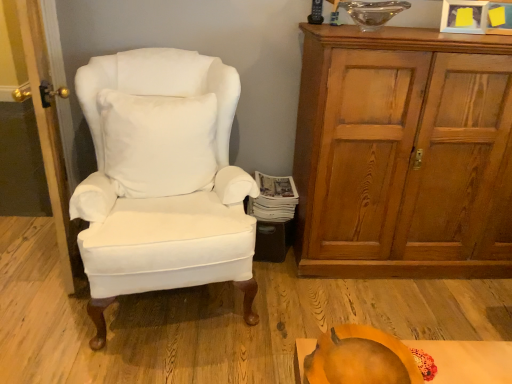
Question: Considering the relative sizes of white cotton wingback chair at left and wooden door at left in the image provided, is white cotton wingback chair at left thinner than wooden door at left?

Choices:
 (A) no
 (B) yes

Answer: (A)

Question: Is white cotton wingback chair at left further to camera compared to wooden door at left?

Choices:
 (A) no
 (B) yes

Answer: (A)

Question: Is white cotton wingback chair at left facing towards wooden door at left?

Choices:
 (A) yes
 (B) no

Answer: (B)

Question: Is white cotton wingback chair at left bigger than wooden door at left?

Choices:
 (A) no
 (B) yes

Answer: (B)

Question: From a real-world perspective, is white cotton wingback chair at left positioned over wooden door at left based on gravity?

Choices:
 (A) no
 (B) yes

Answer: (A)

Question: Is point (316, 347) closer or farther from the camera than point (338, 253)?

Choices:
 (A) farther
 (B) closer

Answer: (B)

Question: From the image's perspective, relative to wooden cabinet at right, is orange matte pumpkin at lower center above or below?

Choices:
 (A) below
 (B) above

Answer: (A)

Question: Is orange matte pumpkin at lower center wider or thinner than wooden cabinet at right?

Choices:
 (A) thin
 (B) wide

Answer: (A)

Question: Considering the relative positions of orange matte pumpkin at lower center and wooden cabinet at right in the image provided, is orange matte pumpkin at lower center to the left or to the right of wooden cabinet at right?

Choices:
 (A) left
 (B) right

Answer: (A)

Question: From the image's perspective, is white soft pillow at center located above or below wooden door at left?

Choices:
 (A) above
 (B) below

Answer: (B)

Question: Choose the correct answer: Is white soft pillow at center inside wooden door at left or outside it?

Choices:
 (A) inside
 (B) outside

Answer: (B)

Question: In the image, is white soft pillow at center on the left side or the right side of wooden door at left?

Choices:
 (A) left
 (B) right

Answer: (B)

Question: Considering the positions of white soft pillow at center and wooden door at left in the image, is white soft pillow at center bigger or smaller than wooden door at left?

Choices:
 (A) small
 (B) big

Answer: (A)

Question: From a real-world perspective, relative to orange matte pumpkin at lower center, is wooden door at left vertically above or below?

Choices:
 (A) below
 (B) above

Answer: (B)

Question: Is wooden door at left in front of or behind orange matte pumpkin at lower center in the image?

Choices:
 (A) behind
 (B) front

Answer: (A)